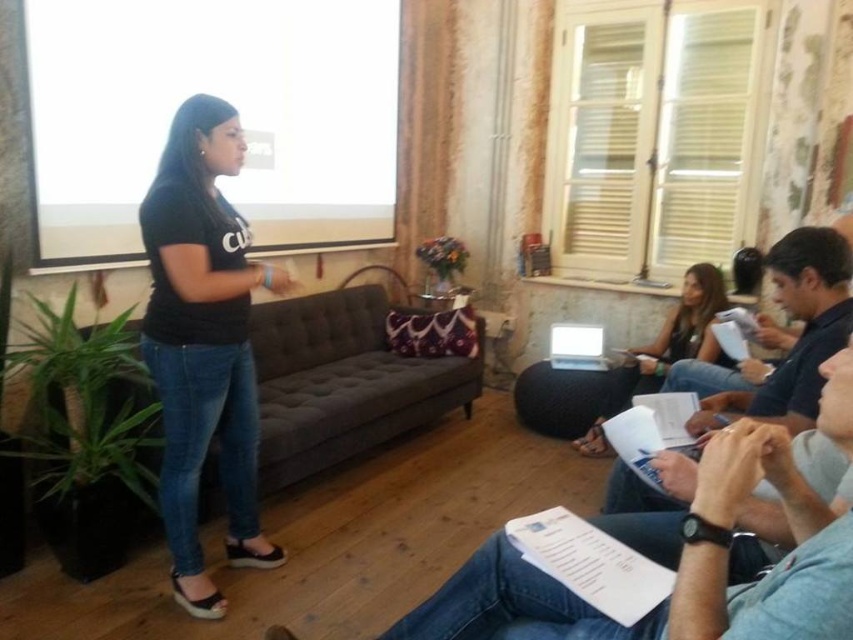
Describe the element at coordinates (665, 349) in the screenshot. I see `matte black laptop at center` at that location.

Measure the distance between matte black laptop at center and camera.

A distance of 10.85 feet exists between matte black laptop at center and camera.

Identify the location of matte black laptop at center. The height and width of the screenshot is (640, 853). (665, 349).

Which is in front, point (840, 326) or point (553, 365)?

Point (840, 326) is in front.

Does dark blue shirt at lower right come behind white plastic laptop at center?

That is False.

Locate an element on the screen. The image size is (853, 640). dark blue shirt at lower right is located at coordinates (802, 330).

Consider the image. Which is more to the right, dark blue shirt at lower right or matte black laptop at center?

matte black laptop at center is more to the right.

Can you confirm if dark blue shirt at lower right is positioned below matte black laptop at center?

Indeed, dark blue shirt at lower right is positioned under matte black laptop at center.

The height and width of the screenshot is (640, 853). Identify the location of dark blue shirt at lower right. (802, 330).